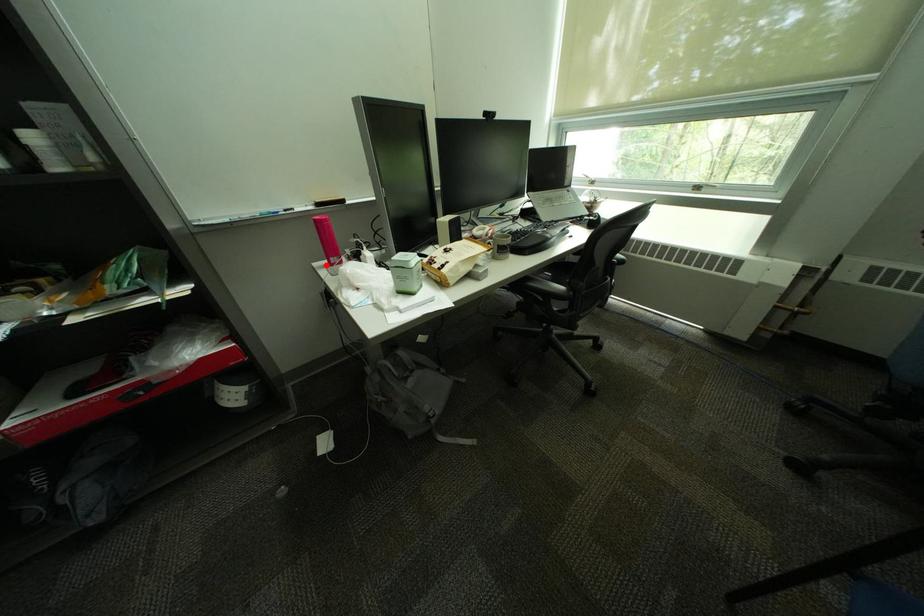
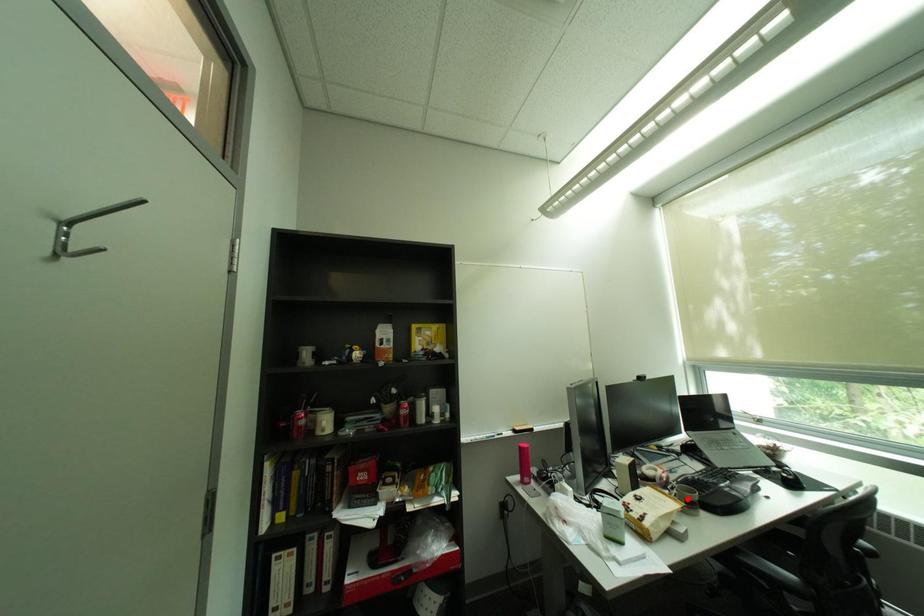
I am providing you with two images of the same scene from different viewpoints. A red point is marked on the first image and another point is marked on the second image. Do the highlighted points in image1 and image2 indicate the same real-world spot?

No